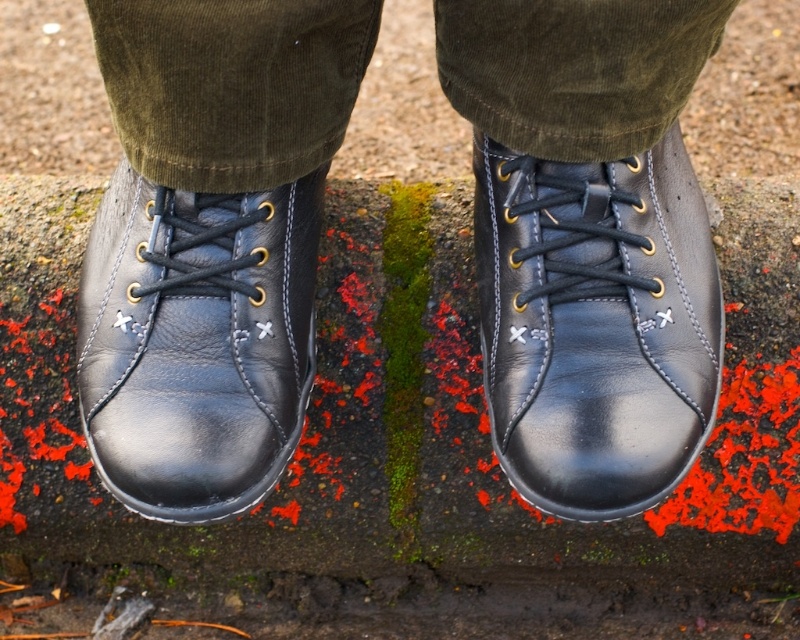
Question: Which point appears farthest from the camera in this image?

Choices:
 (A) (626, 221)
 (B) (532, 276)

Answer: (B)

Question: Which object is closer to the camera taking this photo?

Choices:
 (A) shiny black leather boot at center
 (B) black leather shoes at center

Answer: (B)

Question: Observing the image, what is the correct spatial positioning of black leather shoes at center in reference to shiny black leather boot at center?

Choices:
 (A) left
 (B) right

Answer: (A)

Question: Observing the image, what is the correct spatial positioning of black leather shoes at center in reference to shiny black shoe at left?

Choices:
 (A) above
 (B) below

Answer: (A)

Question: Is the position of black leather shoes at center less distant than that of shiny black leather boot at center?

Choices:
 (A) no
 (B) yes

Answer: (B)

Question: Which point is closer to the camera taking this photo?

Choices:
 (A) (528, 10)
 (B) (200, 243)

Answer: (A)